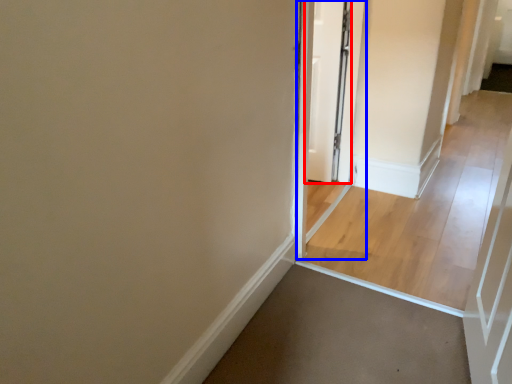
Question: Which object appears closest to the camera in this image, door (highlighted by a red box) or screen door (highlighted by a blue box)?

Choices:
 (A) door
 (B) screen door

Answer: (B)